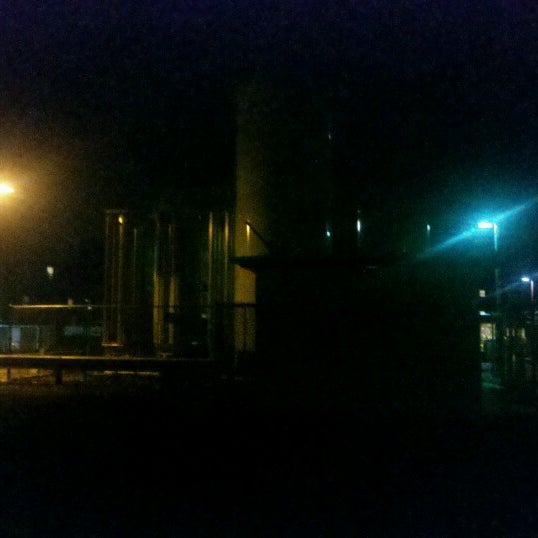
This screenshot has width=538, height=538. I want to click on blue/white light, so click(x=358, y=224), click(x=329, y=232), click(x=426, y=228), click(x=491, y=226), click(x=525, y=281).